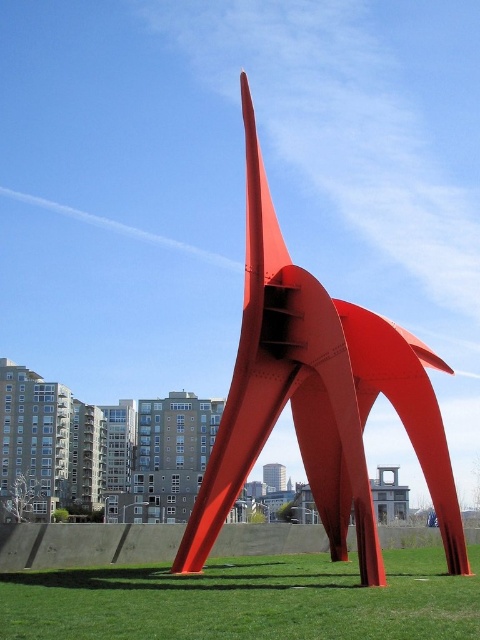
Question: Which of the following is the farthest from the observer?

Choices:
 (A) green grass at center
 (B) glossy steel sculpture at center

Answer: (B)

Question: Can you confirm if glossy steel sculpture at center is smaller than green grass at center?

Choices:
 (A) yes
 (B) no

Answer: (B)

Question: Observing the image, what is the correct spatial positioning of glossy steel sculpture at center in reference to green grass at center?

Choices:
 (A) above
 (B) below

Answer: (A)

Question: Does glossy steel sculpture at center appear on the right side of green grass at center?

Choices:
 (A) yes
 (B) no

Answer: (A)

Question: Which point appears closest to the camera in this image?

Choices:
 (A) (299, 387)
 (B) (24, 624)

Answer: (B)